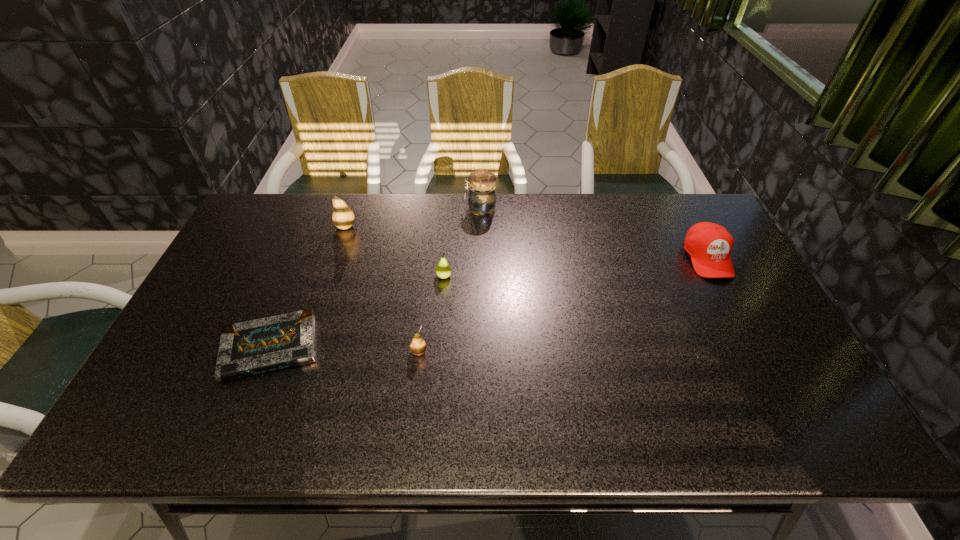
Where is `jar`? The image size is (960, 540). jar is located at coordinates (481, 196).

In order to click on the fifth object from left to right in this screenshot , I will do `click(481, 196)`.

The width and height of the screenshot is (960, 540). I want to click on the leftmost pear, so click(343, 217).

Locate an element on the screen. the second farthest object is located at coordinates (343, 217).

At what (x,y) coordinates should I click in order to perform the action: click on baseball cap. Please return your answer as a coordinate pair (x, y). The width and height of the screenshot is (960, 540). Looking at the image, I should click on (709, 245).

The height and width of the screenshot is (540, 960). I want to click on the second farthest pear, so click(443, 270).

Find the location of a particular element. This screenshot has width=960, height=540. the third object from right to left is located at coordinates (443, 270).

The width and height of the screenshot is (960, 540). I want to click on the fourth object from right to left, so click(418, 346).

I want to click on the second pear from right to left, so click(x=418, y=346).

Where is `notebook`? notebook is located at coordinates (257, 346).